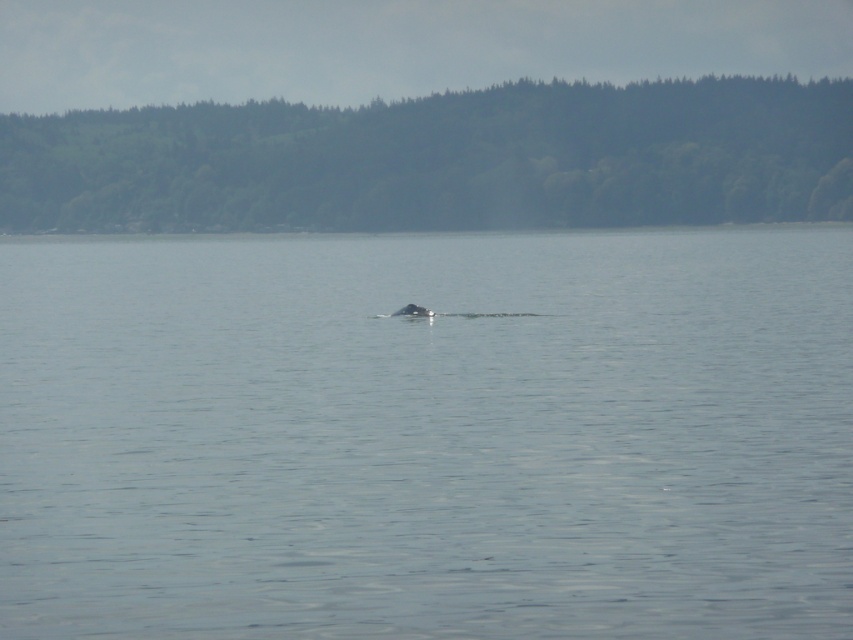
What do you see at coordinates (427, 435) in the screenshot?
I see `clear water at center` at bounding box center [427, 435].

Does clear water at center appear on the right side of gray matte whale at center?

No, clear water at center is not to the right of gray matte whale at center.

Where is `clear water at center`? This screenshot has height=640, width=853. clear water at center is located at coordinates (427, 435).